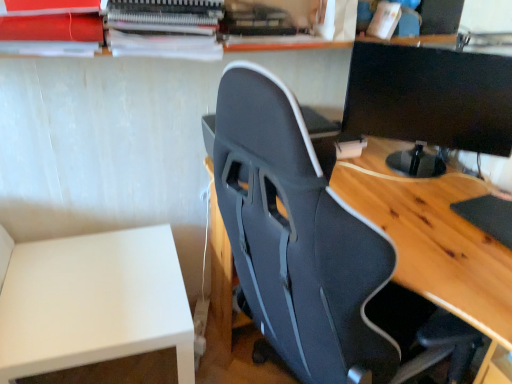
Locate an element on the screen. The image size is (512, 384). free space in front of black glossy monitor at upper right is located at coordinates (433, 219).